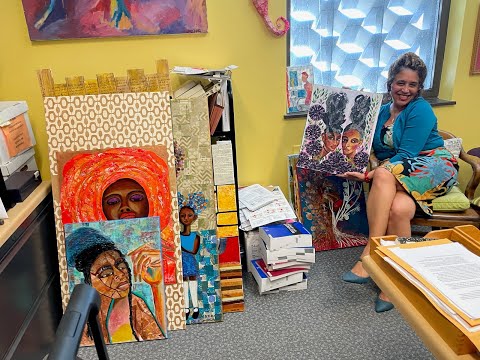
This screenshot has height=360, width=480. What are the coordinates of `painting of women` in the screenshot? It's located at pos(339,137), pos(189,237).